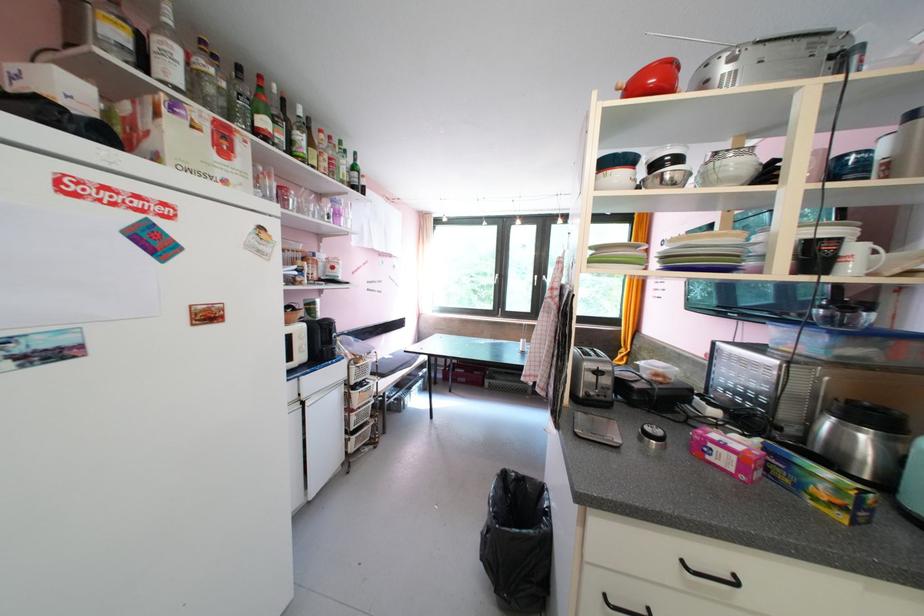
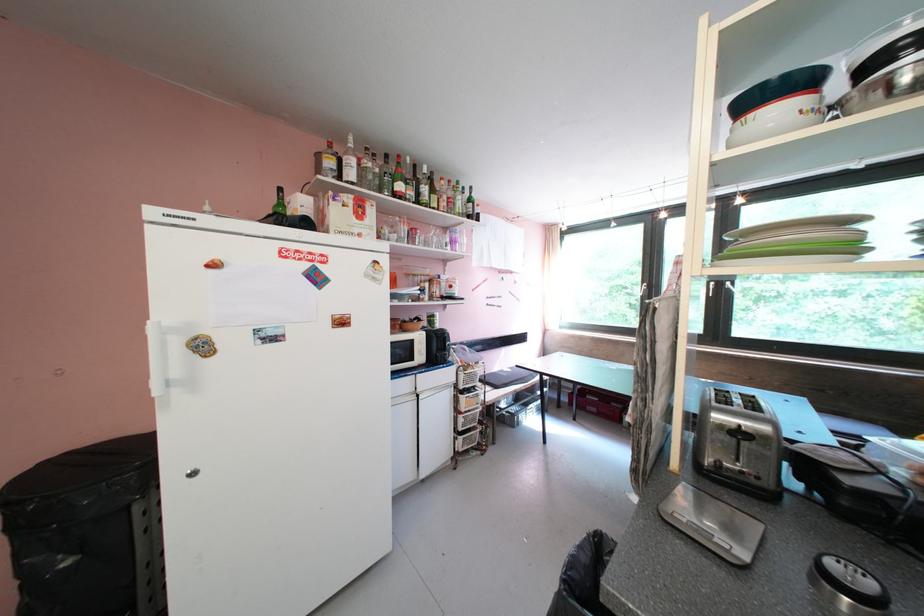
Question: The images are taken continuously from a first-person perspective. In which direction is your viewpoint rotating?

Choices:
 (A) Left
 (B) Right
 (C) Up
 (D) Down

Answer: (A)